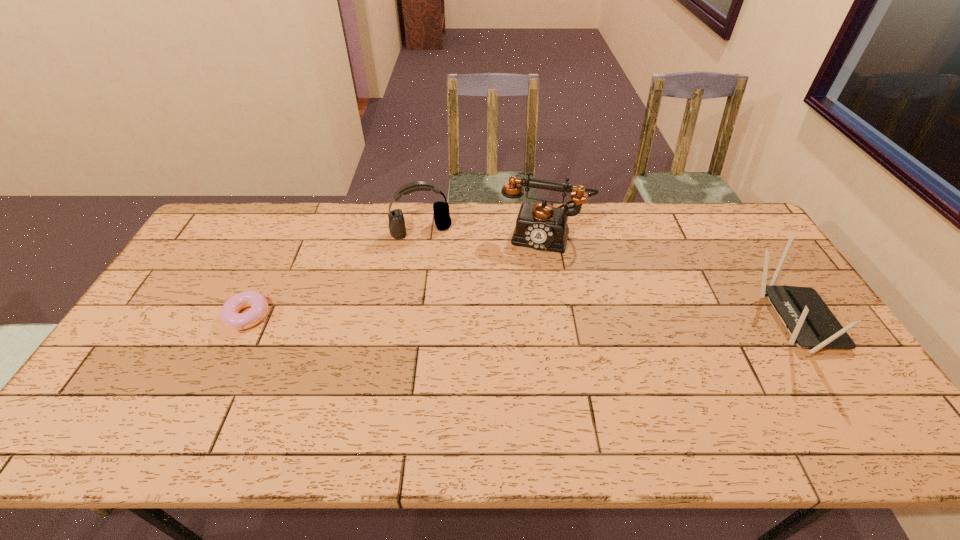
In the image, there is a desktop. Where is `vacant region at the far right corner`? vacant region at the far right corner is located at coordinates (723, 242).

You are a GUI agent. You are given a task and a screenshot of the screen. Output one action in this format:
    pyautogui.click(x=<x>, y=<y>)
    Task: Click on the free area in between the leftmost object and the router
    
    Given the screenshot: What is the action you would take?
    pyautogui.click(x=520, y=319)

Where is `vacant area that lies between the second object from left to right and the rightmost object`? vacant area that lies between the second object from left to right and the rightmost object is located at coordinates (607, 275).

Image resolution: width=960 pixels, height=540 pixels. I want to click on free space between the telephone and the rightmost object, so click(669, 279).

The width and height of the screenshot is (960, 540). What are the coordinates of `free space between the shortest object and the router` in the screenshot? It's located at (520, 319).

At what (x,y) coordinates should I click in order to perform the action: click on free area in between the telephone and the third object from right to left. Please return your answer as a coordinate pair (x, y). Looking at the image, I should click on (483, 234).

The width and height of the screenshot is (960, 540). Identify the location of free space between the router and the third object from left to right. (669, 279).

Where is `vacant area that lies between the second object from left to right and the third object from left to right`? Image resolution: width=960 pixels, height=540 pixels. vacant area that lies between the second object from left to right and the third object from left to right is located at coordinates (483, 234).

This screenshot has width=960, height=540. I want to click on free space between the router and the second object from right to left, so click(x=669, y=279).

At what (x,y) coordinates should I click in order to perform the action: click on free space between the leftmost object and the telephone. Please return your answer as a coordinate pair (x, y). The image size is (960, 540). Looking at the image, I should click on (396, 276).